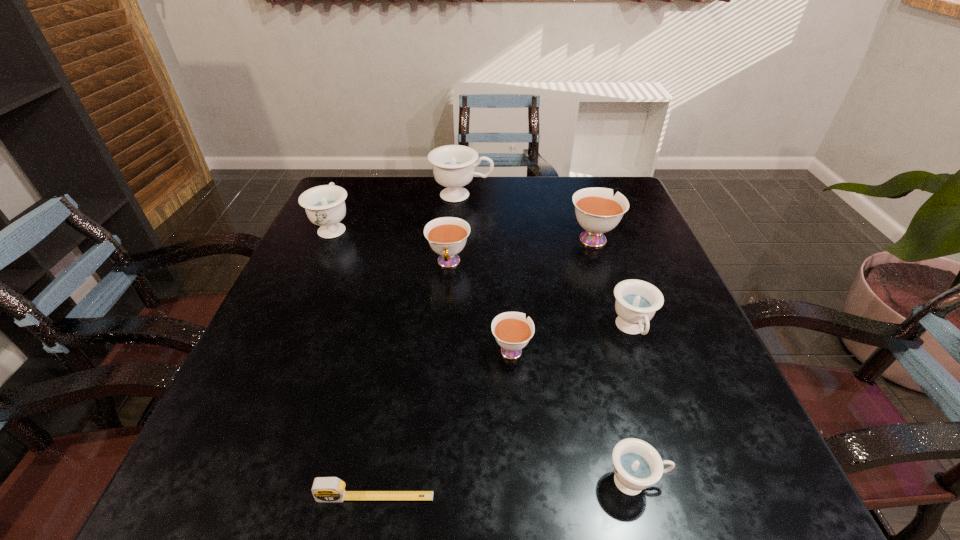
Identify the location of vacant point located on the side of the smallest white teacup with the handle. This screenshot has width=960, height=540. (503, 224).

You are a GUI agent. You are given a task and a screenshot of the screen. Output one action in this format:
    pyautogui.click(x=<x>, y=<y>)
    Task: Click on the vacant area situated on the side of the nearest teacup with the handle
    This screenshot has height=540, width=960.
    Given the screenshot: What is the action you would take?
    pyautogui.click(x=727, y=481)

Identify the location of teacup situated at the near edge. (637, 465).

Where is `tape measure at the near edge`? This screenshot has width=960, height=540. tape measure at the near edge is located at coordinates (325, 489).

You are a GUI agent. You are given a task and a screenshot of the screen. Output one action in this format:
    pyautogui.click(x=<x>, y=<y>)
    Task: Click on the object positioned at the left edge
    Image resolution: width=960 pixels, height=540 pixels.
    Given the screenshot: What is the action you would take?
    [324, 205]

I want to click on object present at the far left corner, so click(324, 205).

Locate an element on the screen. This screenshot has width=960, height=540. object at the near right corner is located at coordinates (637, 465).

Image resolution: width=960 pixels, height=540 pixels. Find the location of `vacant space at the far edge`. vacant space at the far edge is located at coordinates (390, 210).

You are a GUI agent. You are given a task and a screenshot of the screen. Output one action in this format:
    pyautogui.click(x=<x>, y=<y>)
    Task: Click on the vacant space at the near edge of the desktop
    The width and height of the screenshot is (960, 540).
    Given the screenshot: What is the action you would take?
    pyautogui.click(x=522, y=457)

Where is `vacant position at the left edge of the desktop`? The width and height of the screenshot is (960, 540). vacant position at the left edge of the desktop is located at coordinates (298, 389).